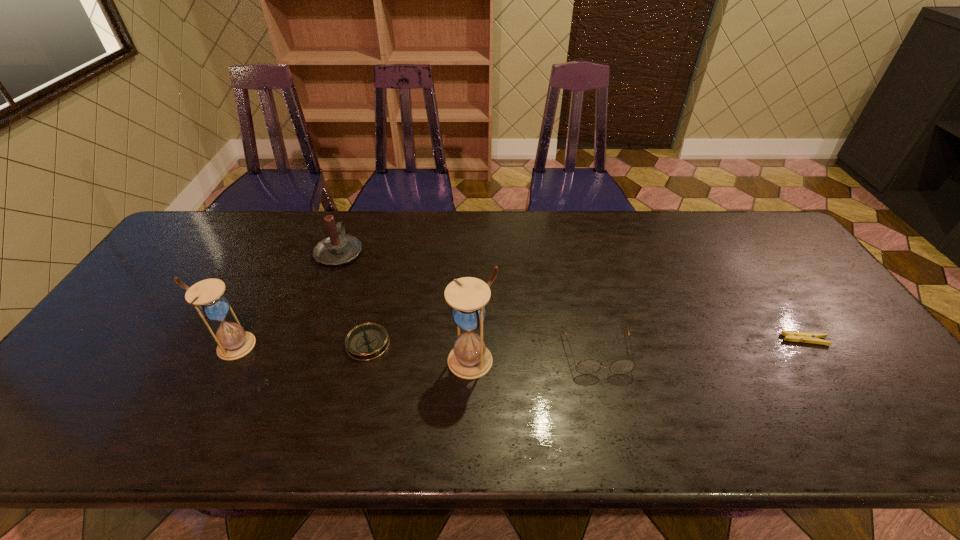
You are a GUI agent. You are given a task and a screenshot of the screen. Output one action in this format:
    pyautogui.click(x=<x>, y=<y>)
    Task: Click on the second object from right to left
    The image size is (960, 540).
    Given the screenshot: What is the action you would take?
    pyautogui.click(x=590, y=366)

Locate an element on the screen. The height and width of the screenshot is (540, 960). the third shortest object is located at coordinates (590, 366).

Identify the location of vacant space positioned on the left of the shorter hourglass. (188, 346).

Identify the location of vacant area situated on the left of the right hourglass. The image size is (960, 540). (344, 360).

The image size is (960, 540). Find the location of `free space located on the side of the fifth object from right to left with the handle loop`. free space located on the side of the fifth object from right to left with the handle loop is located at coordinates (354, 210).

Where is `free point located on the side of the fifth object from right to left with the handle loop`? free point located on the side of the fifth object from right to left with the handle loop is located at coordinates (349, 225).

You are a GUI agent. You are given a task and a screenshot of the screen. Output one action in this format:
    pyautogui.click(x=<x>, y=<y>)
    Task: Click on the blank space located 0.280m on the right of the fourth object from right to left
    
    Given the screenshot: What is the action you would take?
    pyautogui.click(x=498, y=343)

The height and width of the screenshot is (540, 960). I want to click on free location located on the left of the shortest object, so coord(706,340).

Where is `free point located on the temples of the third shortest object`? This screenshot has width=960, height=540. free point located on the temples of the third shortest object is located at coordinates pyautogui.click(x=611, y=407).

Where is `object located at the far edge`? object located at the far edge is located at coordinates (338, 249).